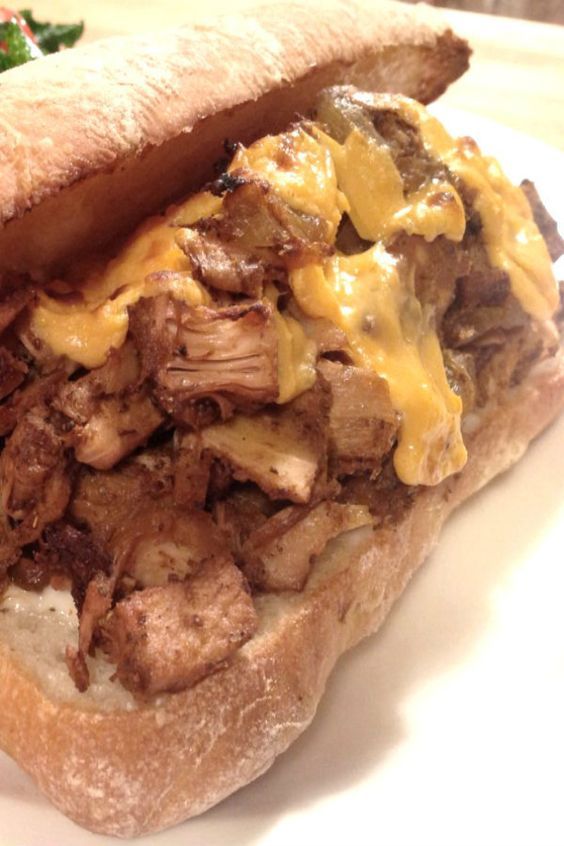
Where is `white plate`? The height and width of the screenshot is (846, 564). white plate is located at coordinates (487, 128).